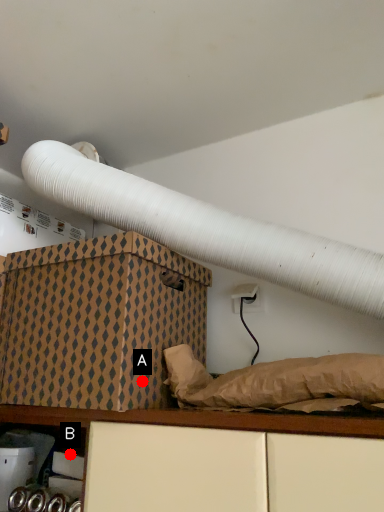
Question: Two points are circled on the image, labeled by A and B beside each circle. Which point is further to the camera?

Choices:
 (A) A is further
 (B) B is further

Answer: (B)